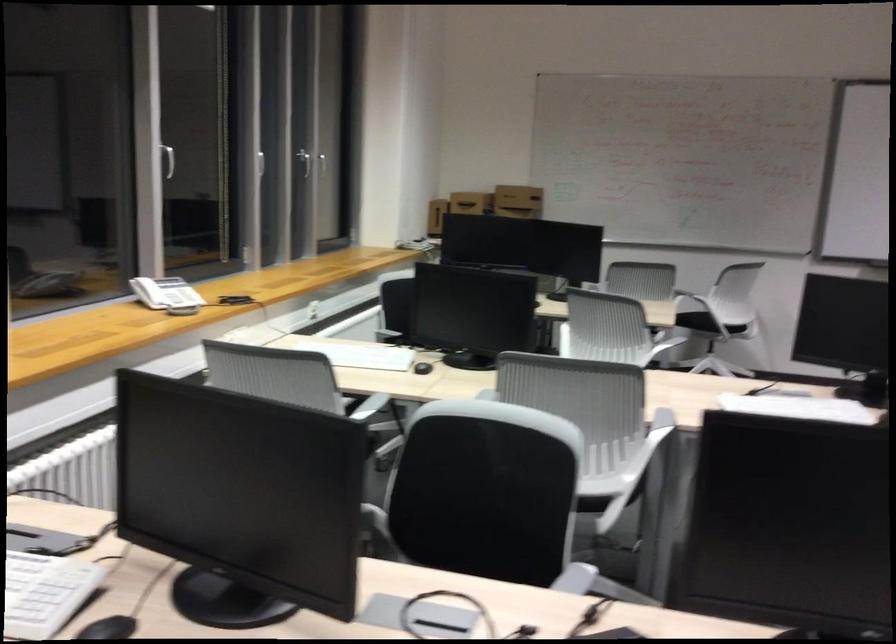
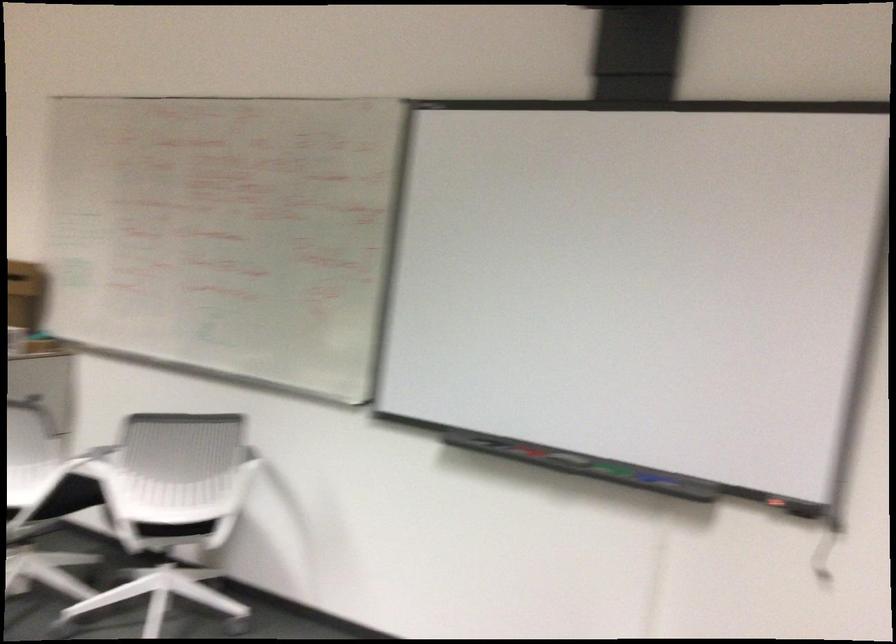
Find the pixel in the second image that matches (711,281) in the first image.

(95, 460)